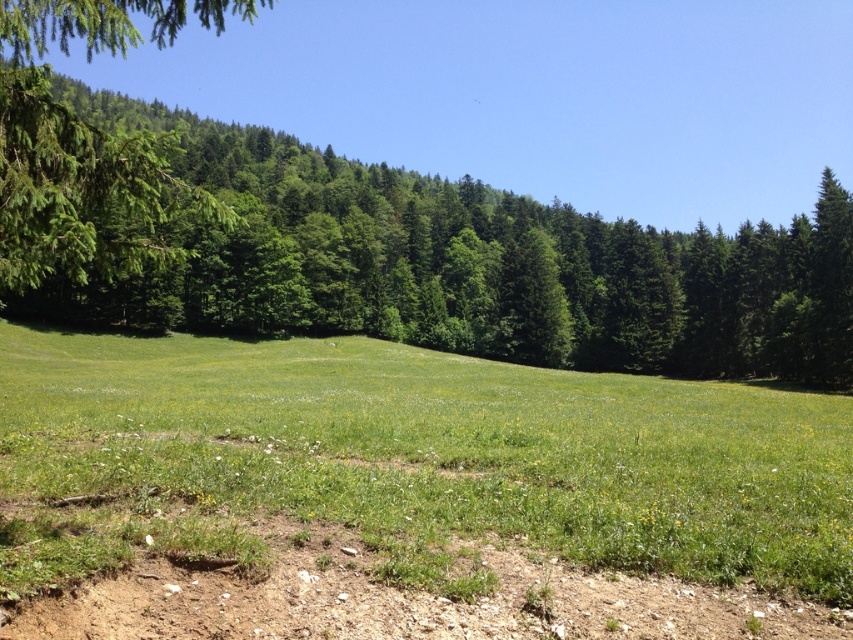
Can you confirm if green leafy tree at upper left is positioned above brown dirt track at lower center?

Correct, green leafy tree at upper left is located above brown dirt track at lower center.

Based on the photo, is green leafy tree at upper left behind brown dirt track at lower center?

Yes.

I want to click on green leafy tree at upper left, so click(469, 266).

Between point (103, 616) and point (132, 1), which one is positioned behind?

The point (132, 1) is more distant.

The height and width of the screenshot is (640, 853). What do you see at coordinates (404, 600) in the screenshot?
I see `brown dirt track at lower center` at bounding box center [404, 600].

The image size is (853, 640). I want to click on brown dirt track at lower center, so click(x=404, y=600).

Looking at this image, who is positioned more to the left, green grassy field at center or brown dirt track at lower center?

green grassy field at center

Identify the location of green grassy field at center. (410, 460).

The width and height of the screenshot is (853, 640). Identify the location of green grassy field at center. (410, 460).